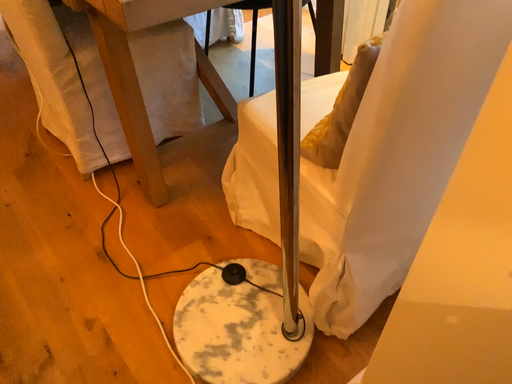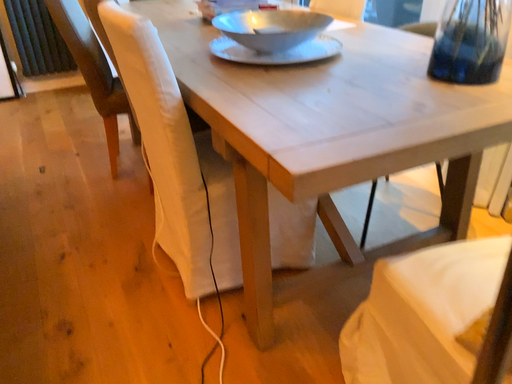
Question: How did the camera likely rotate when shooting the video?

Choices:
 (A) rotated downward
 (B) rotated upward

Answer: (B)